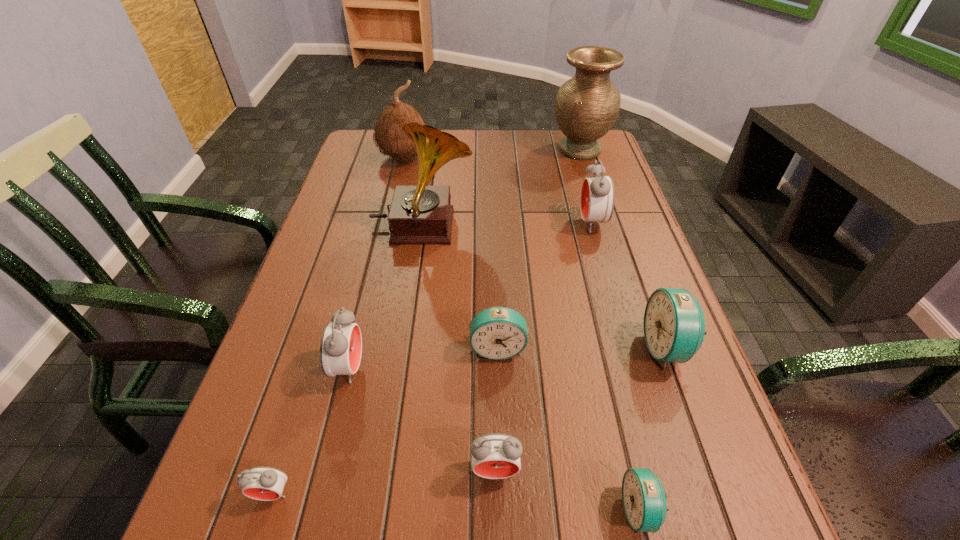
Find the location of `alarm clock that stands as the sixth closest to the leftmost alarm clock`. alarm clock that stands as the sixth closest to the leftmost alarm clock is located at coordinates [597, 198].

Where is `the fifth closest alarm clock to the nearest blue alarm clock`? Image resolution: width=960 pixels, height=540 pixels. the fifth closest alarm clock to the nearest blue alarm clock is located at coordinates (262, 483).

Locate an element on the screen. red alarm clock that is the second closest to the coconut is located at coordinates (341, 343).

Image resolution: width=960 pixels, height=540 pixels. I want to click on red alarm clock that is the closest one to the coconut, so click(x=597, y=198).

At what (x,y) coordinates should I click in order to perform the action: click on blue alarm clock that is the third nearest to the third tallest object. Please return your answer as a coordinate pair (x, y). This screenshot has width=960, height=540. Looking at the image, I should click on (644, 500).

You are a GUI agent. You are given a task and a screenshot of the screen. Output one action in this format:
    pyautogui.click(x=<x>, y=<y>)
    Task: Click on the blue alarm clock object that ranks as the closest to the vase
    
    Given the screenshot: What is the action you would take?
    pyautogui.click(x=674, y=326)

Where is `vacant space that satisfies the following two spatial constraints: 1. from the horn of the brown phonograph record; 2. on the face of the leftmost red alarm clock`? vacant space that satisfies the following two spatial constraints: 1. from the horn of the brown phonograph record; 2. on the face of the leftmost red alarm clock is located at coordinates (383, 493).

Find the location of `vacant space that satisfies the following two spatial constraints: 1. on the face of the sixth alarm clock from right to left; 2. on the face of the leftmost red alarm clock`. vacant space that satisfies the following two spatial constraints: 1. on the face of the sixth alarm clock from right to left; 2. on the face of the leftmost red alarm clock is located at coordinates (318, 493).